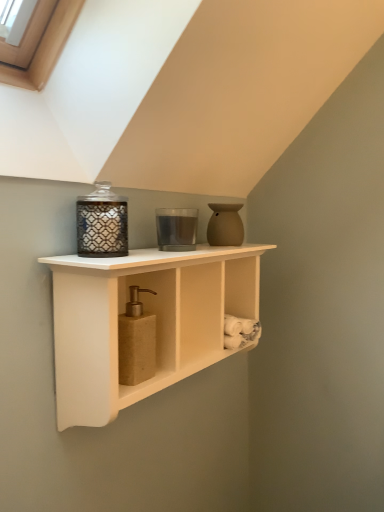
Where is `empty space that is to the right of matte glass candle holder at upper left, positioned as the 2th candle holder in right-to-left order`? The height and width of the screenshot is (512, 384). empty space that is to the right of matte glass candle holder at upper left, positioned as the 2th candle holder in right-to-left order is located at coordinates (161, 257).